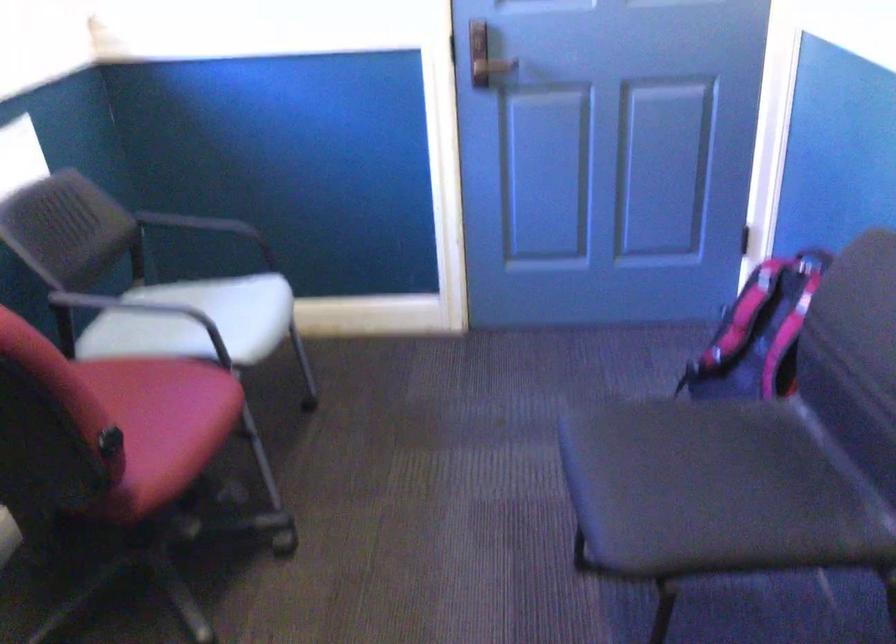
What do you see at coordinates (149, 402) in the screenshot?
I see `the red chair sitting surface` at bounding box center [149, 402].